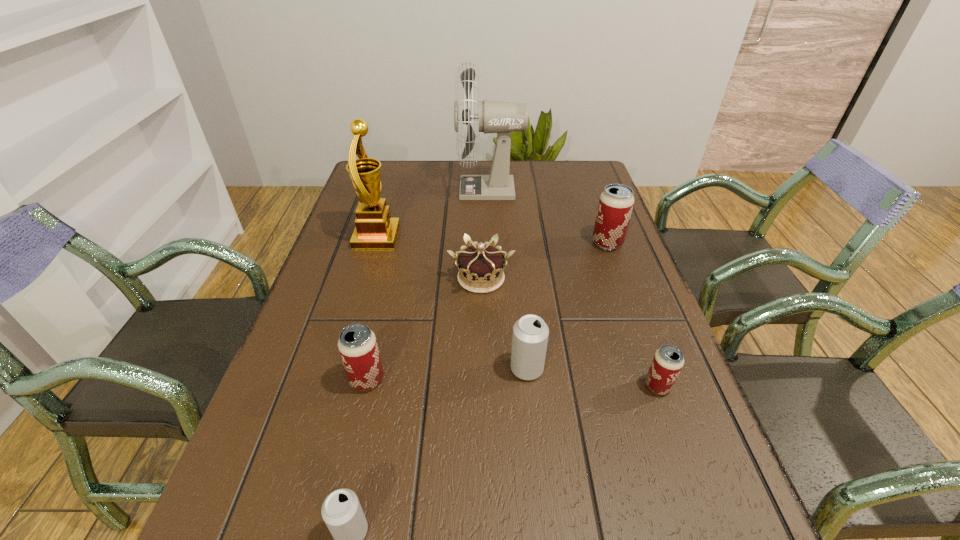
The image size is (960, 540). I want to click on vacant area that lies between the fan and the biggest red beer can, so click(x=548, y=217).

Where is `unoccupied position between the farthest beer can and the bigger white beer can`? This screenshot has width=960, height=540. unoccupied position between the farthest beer can and the bigger white beer can is located at coordinates (567, 306).

Locate an element on the screen. This screenshot has width=960, height=540. vacant space that is in between the gold crown and the bigger white beer can is located at coordinates [504, 323].

Choose which object is the second nearest neighbor to the leftmost red beer can. Please provide its 2D coordinates. Your answer should be formatted as a tuple, i.e. [(x, y)], where the tuple contains the x and y coordinates of a point satisfying the conditions above.

[(480, 266)]

Locate which object is the third closest to the gold award. Please provide its 2D coordinates. Your answer should be formatted as a tuple, i.e. [(x, y)], where the tuple contains the x and y coordinates of a point satisfying the conditions above.

[(357, 344)]

Identify which beer can is the second closest to the farthest object. Please provide its 2D coordinates. Your answer should be formatted as a tuple, i.e. [(x, y)], where the tuple contains the x and y coordinates of a point satisfying the conditions above.

[(530, 333)]

Locate which beer can ranks third in proximity to the tallest beer can. Please provide its 2D coordinates. Your answer should be formatted as a tuple, i.e. [(x, y)], where the tuple contains the x and y coordinates of a point satisfying the conditions above.

[(357, 344)]

Identify which red beer can is the second closest to the farthest object. Please provide its 2D coordinates. Your answer should be formatted as a tuple, i.e. [(x, y)], where the tuple contains the x and y coordinates of a point satisfying the conditions above.

[(357, 344)]

You are a GUI agent. You are given a task and a screenshot of the screen. Output one action in this format:
    pyautogui.click(x=<x>, y=<y>)
    Task: Click on the red beer can that stands as the closest to the biggest red beer can
    
    Given the screenshot: What is the action you would take?
    pyautogui.click(x=668, y=360)

The height and width of the screenshot is (540, 960). Find the location of `free space that satisfies the following two spatial constraints: 1. on the back side of the farthest red beer can; 2. on the left side of the bigger white beer can`. free space that satisfies the following two spatial constraints: 1. on the back side of the farthest red beer can; 2. on the left side of the bigger white beer can is located at coordinates (515, 243).